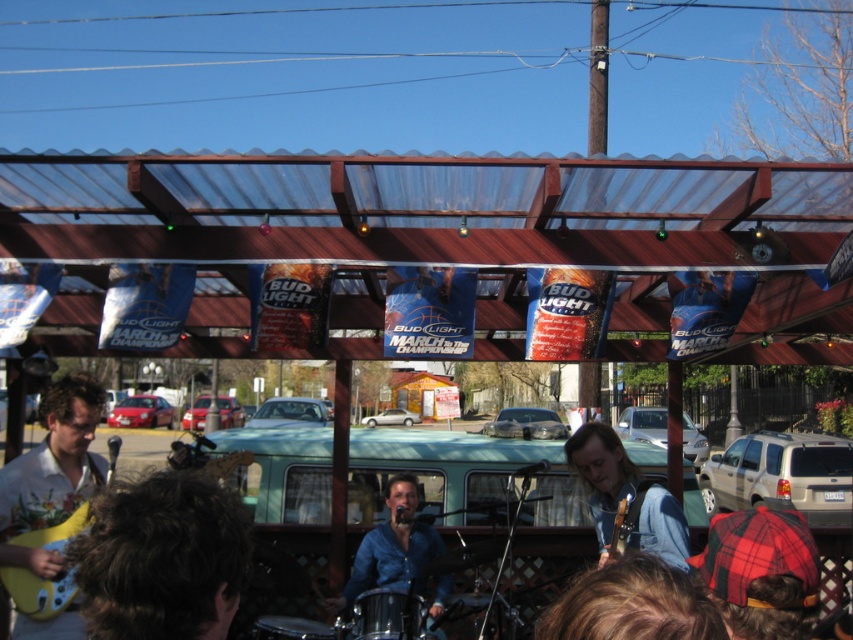
Between floral white shirt at lower left and blue denim shirt at center, which one is positioned lower?

blue denim shirt at center

Can you confirm if floral white shirt at lower left is thinner than blue denim shirt at center?

Correct, floral white shirt at lower left's width is less than blue denim shirt at center's.

Does point (70, 419) lie in front of point (413, 528)?

Yes, it is.

Locate an element on the screen. The height and width of the screenshot is (640, 853). floral white shirt at lower left is located at coordinates (51, 472).